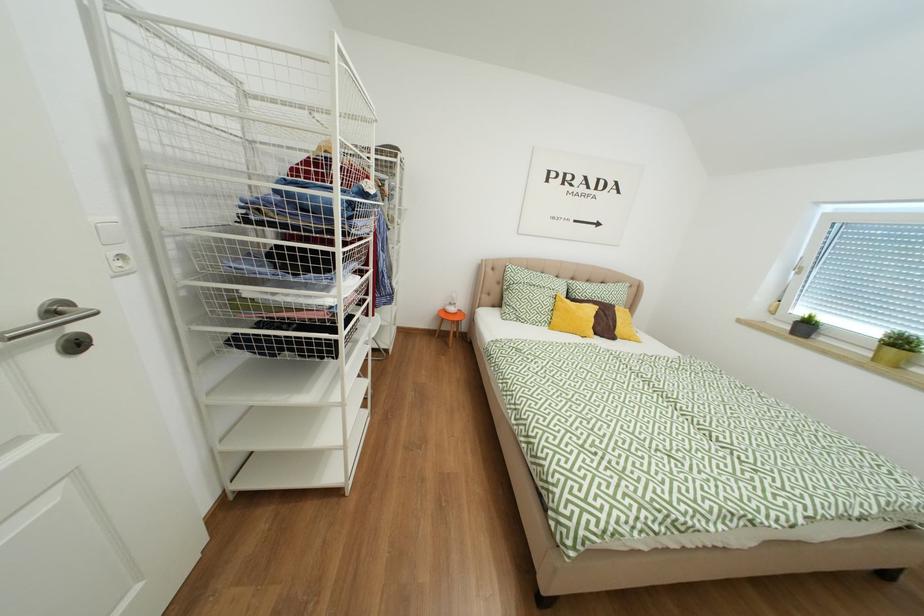
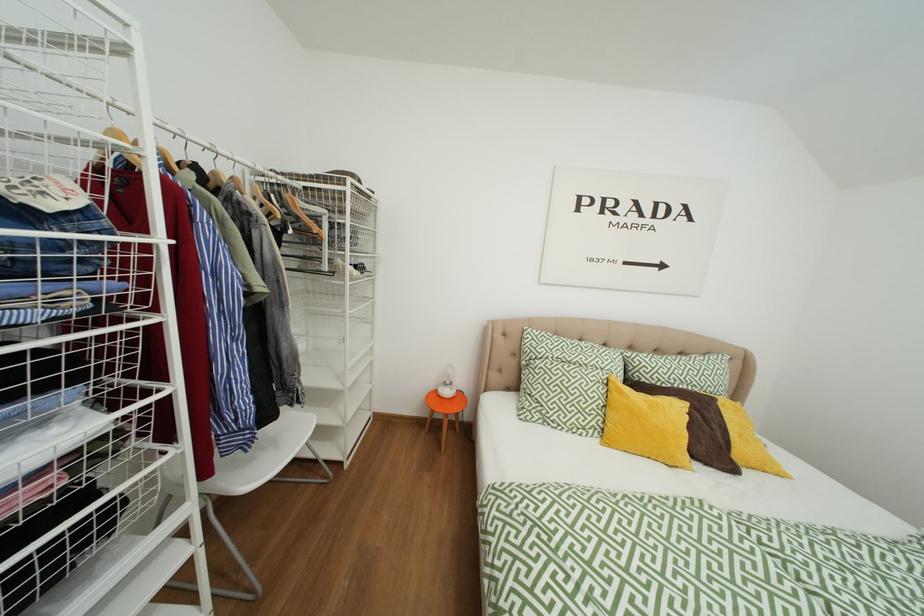
Question: In a continuous first-person perspective shot, in which direction is the camera moving?

Choices:
 (A) Left
 (B) Right
 (C) Forward
 (D) Backward

Answer: (C)